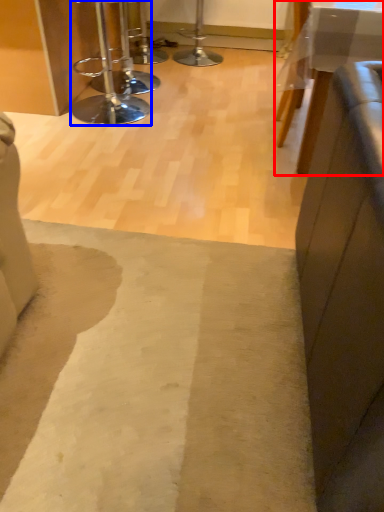
Question: Among these objects, which one is farthest to the camera, table (highlighted by a red box) or stool (highlighted by a blue box)?

Choices:
 (A) table
 (B) stool

Answer: (B)